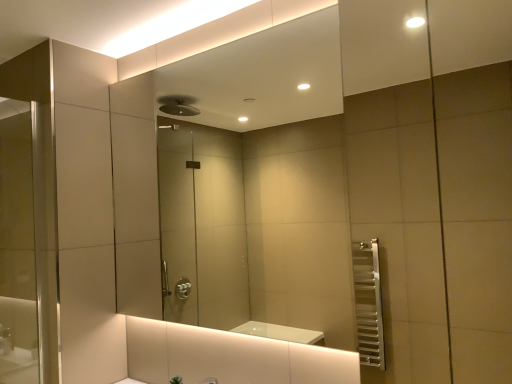
What do you see at coordinates (252, 188) in the screenshot? Image resolution: width=512 pixels, height=384 pixels. I see `matte glass mirror at center` at bounding box center [252, 188].

Find the location of `matte glass mirror at center`. matte glass mirror at center is located at coordinates (252, 188).

Identify the location of matte glass mirror at center. (252, 188).